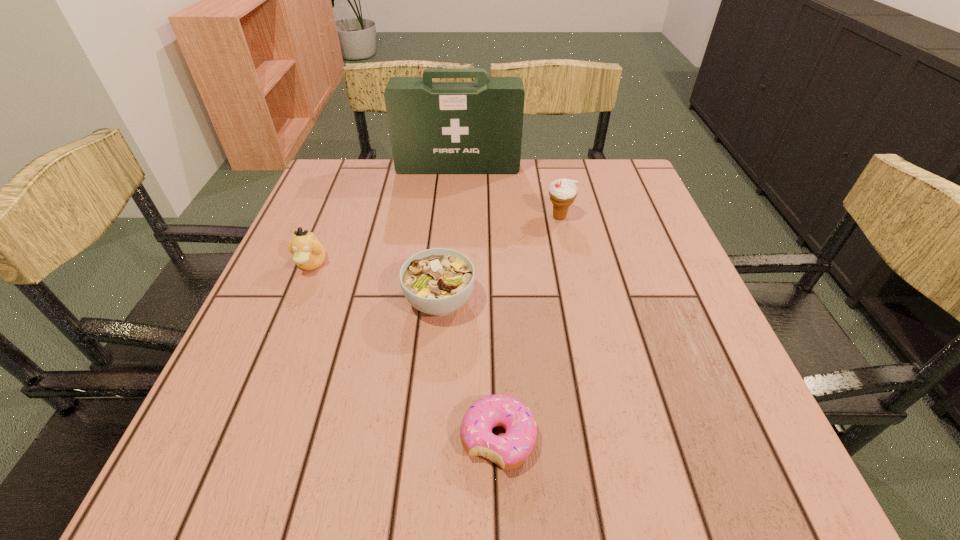
Locate an element on the screen. This screenshot has width=960, height=540. free space between the nearest object and the tallest object is located at coordinates (478, 303).

You are a GUI agent. You are given a task and a screenshot of the screen. Output one action in this format:
    pyautogui.click(x=<x>, y=<y>)
    Task: Click on the vacant region between the tallest object and the duckling
    The height and width of the screenshot is (540, 960).
    Given the screenshot: What is the action you would take?
    pyautogui.click(x=385, y=215)

This screenshot has height=540, width=960. In order to click on free spot between the shortest object and the third tallest object in this screenshot , I will do `click(405, 352)`.

The image size is (960, 540). In order to click on vacant space in between the shortest object and the soup bowl in this screenshot , I will do `click(469, 370)`.

Locate which object is the second closest to the third shortest object. Please provide its 2D coordinates. Your answer should be formatted as a tuple, i.e. [(x, y)], where the tuple contains the x and y coordinates of a point satisfying the conditions above.

[(435, 127)]

Point out which object is positioned as the third nearest to the rightmost object. Please provide its 2D coordinates. Your answer should be formatted as a tuple, i.e. [(x, y)], where the tuple contains the x and y coordinates of a point satisfying the conditions above.

[(512, 449)]

This screenshot has width=960, height=540. Identify the location of free space that satisfies the following two spatial constraints: 1. on the front-facing side of the farthest object; 2. on the right side of the rightmost object. (454, 217).

Locate an element on the screen. Image resolution: width=960 pixels, height=540 pixels. vacant region that satisfies the following two spatial constraints: 1. on the front-facing side of the rightmost object; 2. on the left side of the first-aid kit is located at coordinates (454, 217).

At what (x,y) coordinates should I click in order to perform the action: click on vacant space that satisfies the following two spatial constraints: 1. on the face of the third shortest object; 2. on the right side of the fourth tallest object. Please return your answer as a coordinate pair (x, y). Image resolution: width=960 pixels, height=540 pixels. Looking at the image, I should click on (296, 301).

Locate an element on the screen. This screenshot has height=540, width=960. free location that satisfies the following two spatial constraints: 1. on the front-facing side of the farthest object; 2. on the right side of the icecream is located at coordinates (454, 217).